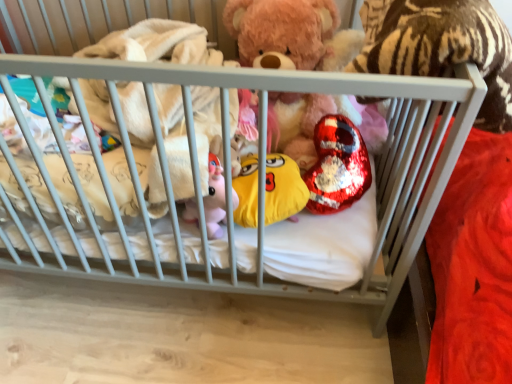
Question: In the image, is yellow plush toy at center, which is counted as the 2th toy, starting from the right, positioned in front of or behind fluffy pink teddy bear at center?

Choices:
 (A) front
 (B) behind

Answer: (A)

Question: From the image's perspective, relative to fluffy pink teddy bear at center, is yellow plush toy at center, which is counted as the 2th toy, starting from the right, above or below?

Choices:
 (A) above
 (B) below

Answer: (B)

Question: Considering the real-world distances, which object is farthest from the fluffy pink teddy bear at center?

Choices:
 (A) shiny sequined heart at center, arranged as the 2th toy when viewed from the left
 (B) yellow plush toy at center, which is counted as the 2th toy, starting from the right

Answer: (B)

Question: Which object is positioned farthest from the fluffy pink teddy bear at center?

Choices:
 (A) yellow plush toy at center, which is counted as the 2th toy, starting from the right
 (B) shiny sequined heart at center, arranged as the 2th toy when viewed from the left

Answer: (A)